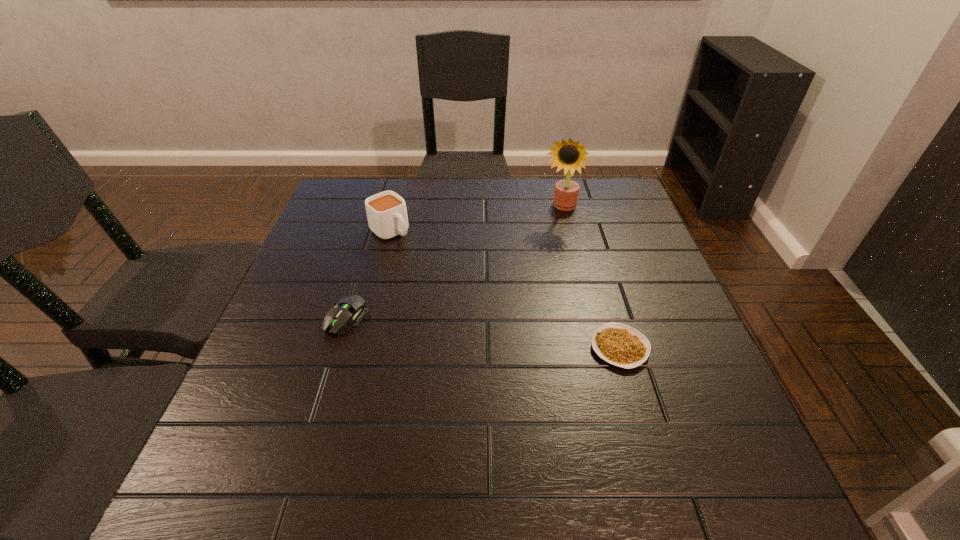
This screenshot has width=960, height=540. In order to click on vacant point located 0.110m on the face of the tallest object in this screenshot , I will do tap(543, 241).

This screenshot has height=540, width=960. Identify the location of free region located on the face of the tallest object. (522, 286).

What are the coordinates of `cup that is at the far edge` in the screenshot? It's located at (386, 212).

At what (x,y) coordinates should I click in order to perform the action: click on sunflower that is at the far edge. Please return your answer as a coordinate pair (x, y). The height and width of the screenshot is (540, 960). Looking at the image, I should click on (569, 155).

Find the location of a particular element. Image resolution: width=960 pixels, height=540 pixels. computer mouse that is at the left edge is located at coordinates (351, 309).

This screenshot has width=960, height=540. Find the location of `cup that is positioned at the left edge`. cup that is positioned at the left edge is located at coordinates (386, 212).

Locate an element on the screen. object positioned at the right edge is located at coordinates (621, 345).

The height and width of the screenshot is (540, 960). In order to click on object that is at the far left corner in this screenshot , I will do `click(386, 212)`.

The width and height of the screenshot is (960, 540). What are the coordinates of `free space at the far edge of the desktop` in the screenshot? It's located at (454, 197).

Identify the location of vacant area at the near edge. This screenshot has width=960, height=540. (602, 436).